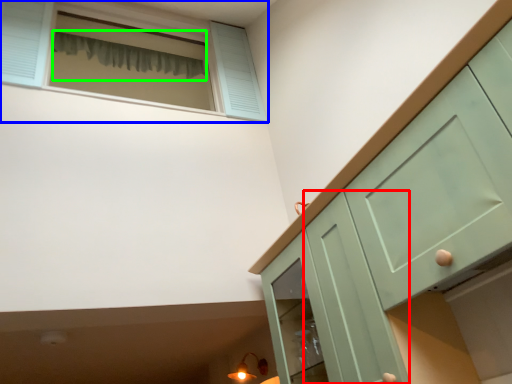
Question: Considering the real-world distances, which object is closest to screen door (highlighted by a red box)? window (highlighted by a blue box) or curtain (highlighted by a green box).

Choices:
 (A) window
 (B) curtain

Answer: (A)